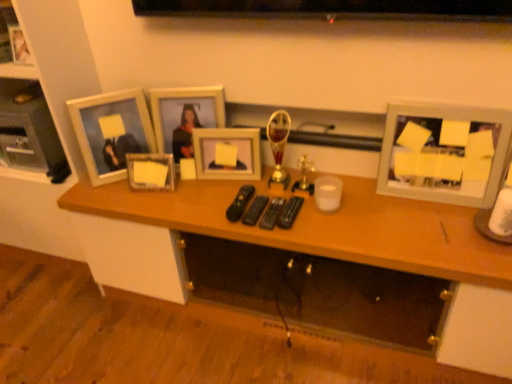
I want to click on free space in front of white matte picture frame at upper left, arranged as the fifth picture frame when viewed from the right, so click(x=122, y=195).